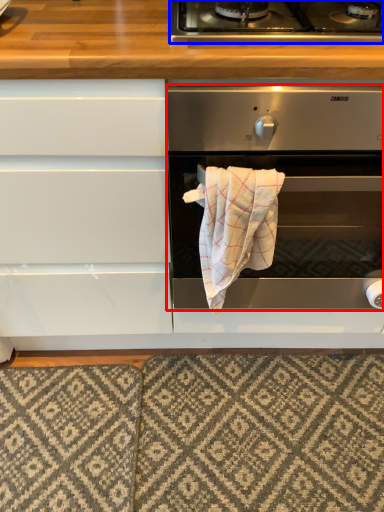
Question: Among these objects, which one is nearest to the camera, oven (highlighted by a red box) or gas stove (highlighted by a blue box)?

Choices:
 (A) oven
 (B) gas stove

Answer: (A)